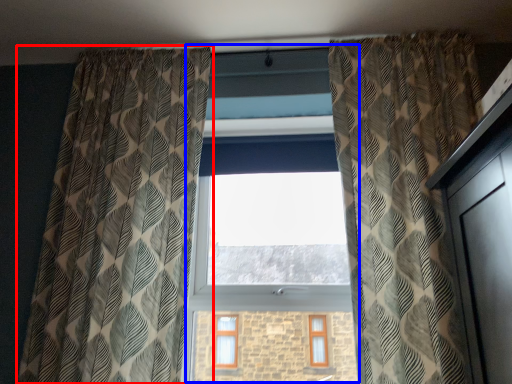
Question: Which of the following is the closest to the observer, curtain (highlighted by a red box) or bay window (highlighted by a blue box)?

Choices:
 (A) curtain
 (B) bay window

Answer: (A)